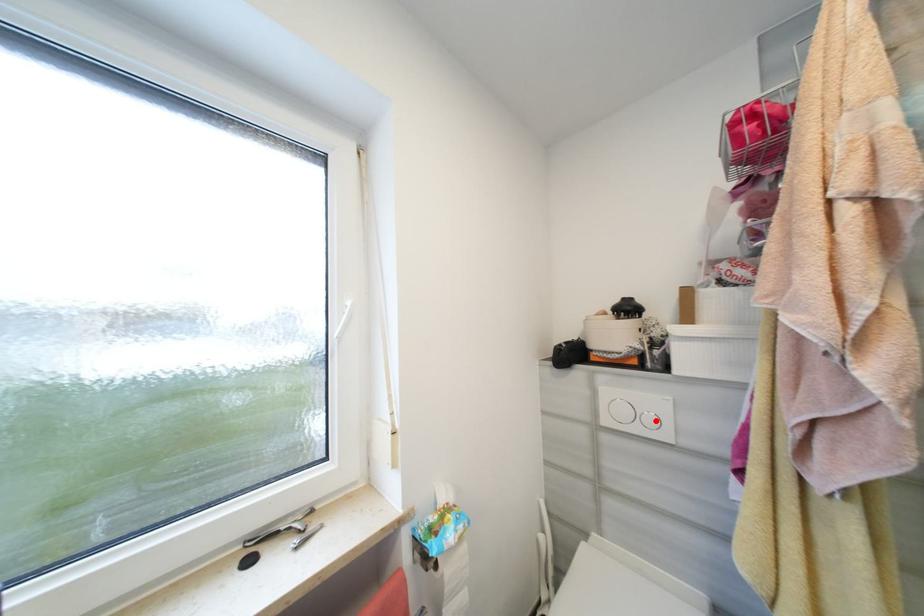
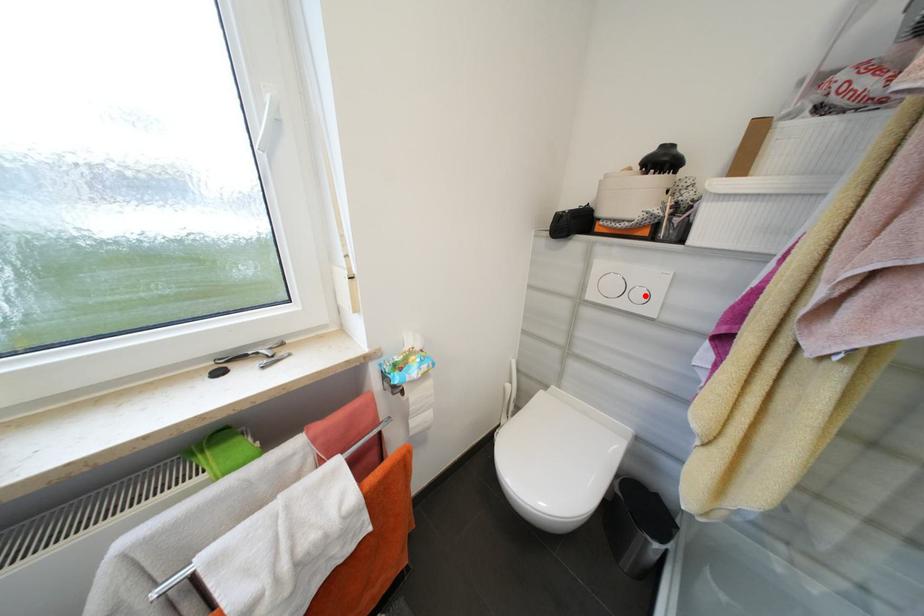
I am providing you with two images of the same scene from different viewpoints. A red point is marked on the first image and another point is marked on the second image. Does the point marked in image1 correspond to the same location as the one in image2?

Yes